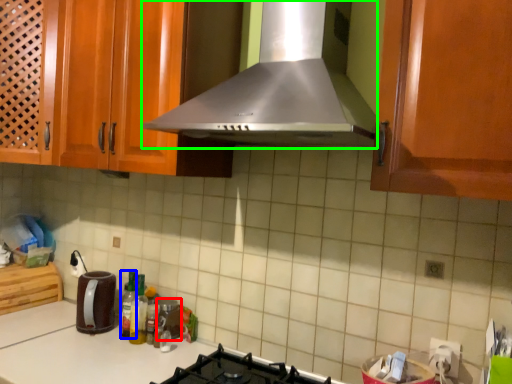
Question: Which is farther away from appliance (highlighted by a red box)? bottle (highlighted by a blue box) or home appliance (highlighted by a green box)?

Choices:
 (A) bottle
 (B) home appliance

Answer: (B)